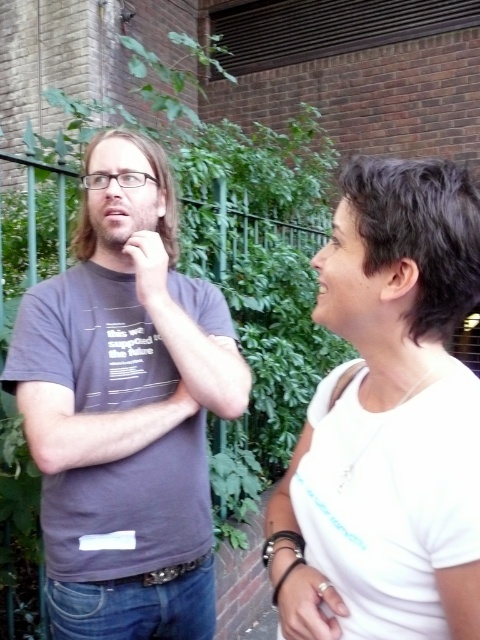
Between matte gray t-shirt at left and white matte shirt at center, which one has less height?

white matte shirt at center is shorter.

Is matte gray t-shirt at left shorter than white matte shirt at center?

In fact, matte gray t-shirt at left may be taller than white matte shirt at center.

This screenshot has width=480, height=640. I want to click on matte gray t-shirt at left, so click(x=124, y=413).

I want to click on matte gray t-shirt at left, so click(x=124, y=413).

Consider the image. Which is more to the left, white matte ring at center or matte skin nose at center?

white matte ring at center

Between point (296, 596) and point (323, 256), which one is positioned behind?

The point (323, 256) is more distant.

Between point (304, 621) and point (312, 259), which one is positioned in front?

Positioned in front is point (304, 621).

Locate an element on the screen. This screenshot has width=480, height=640. white matte ring at center is located at coordinates (309, 605).

Is point (157, 273) positioned in front of point (96, 192)?

Yes, it is.

Does matte skin hand at center have a greater width compared to matte black nose at center?

Indeed, matte skin hand at center has a greater width compared to matte black nose at center.

This screenshot has height=640, width=480. What are the coordinates of `matte skin hand at center` in the screenshot? It's located at (148, 269).

In order to click on matte skin hand at center in this screenshot , I will do `click(148, 269)`.